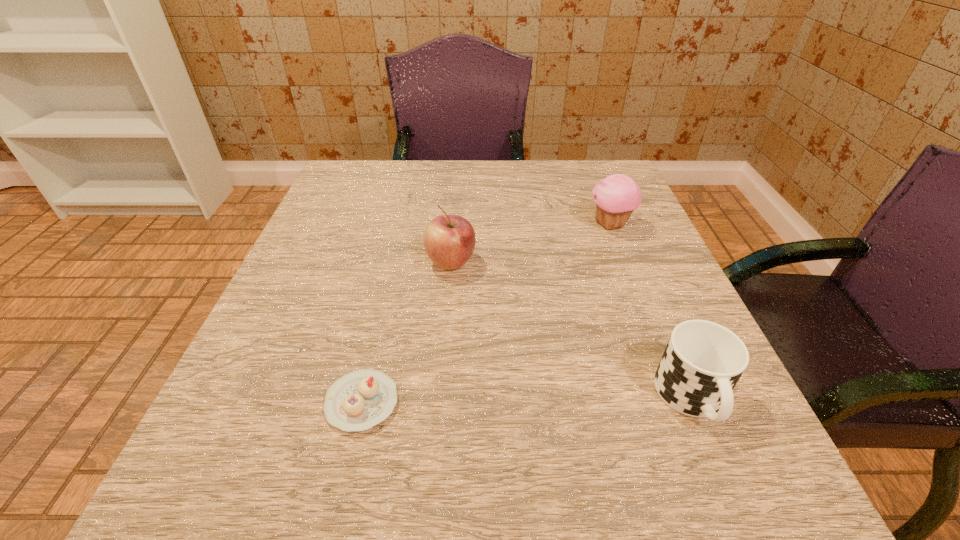
Locate an element on the screen. The height and width of the screenshot is (540, 960). apple is located at coordinates (449, 240).

Find the location of `the third object from right to left`. the third object from right to left is located at coordinates (449, 240).

At what (x,y) coordinates should I click in order to perform the action: click on the taller cupcake. Please return your answer as a coordinate pair (x, y). This screenshot has height=540, width=960. Looking at the image, I should click on (617, 196).

Locate an element on the screen. the right cupcake is located at coordinates (617, 196).

The height and width of the screenshot is (540, 960). Identify the location of cup. (703, 361).

Locate an element on the screen. the shortest object is located at coordinates (359, 400).

The height and width of the screenshot is (540, 960). In order to click on the shorter cupcake in this screenshot , I will do `click(359, 400)`.

Where is `free point located 0.340m on the front of the apple`? The height and width of the screenshot is (540, 960). free point located 0.340m on the front of the apple is located at coordinates (436, 452).

In order to click on vacant space situated 0.380m on the left of the farthest object in this screenshot , I will do `click(413, 225)`.

The width and height of the screenshot is (960, 540). Find the location of `blank space located 0.090m on the side of the second shortest object with the handle`. blank space located 0.090m on the side of the second shortest object with the handle is located at coordinates click(x=740, y=513).